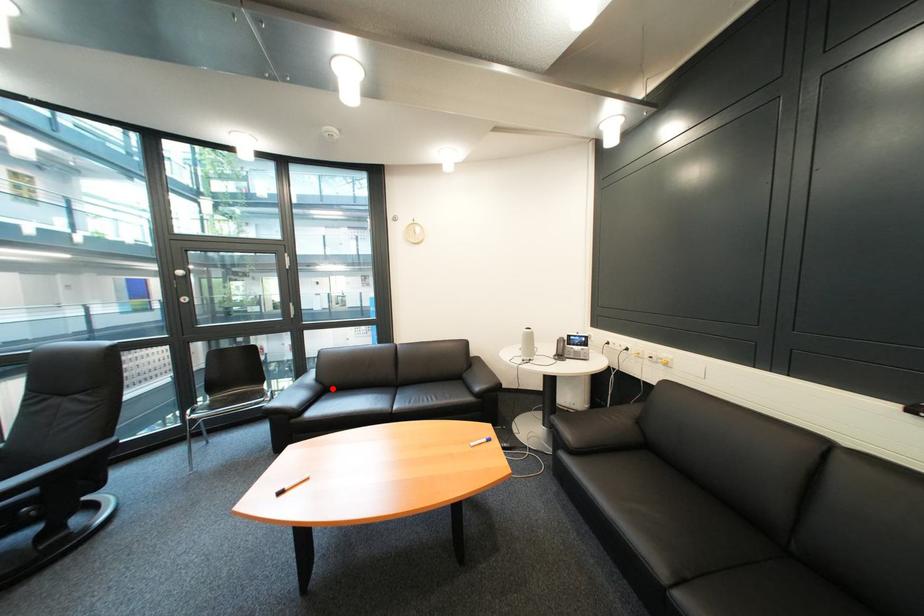
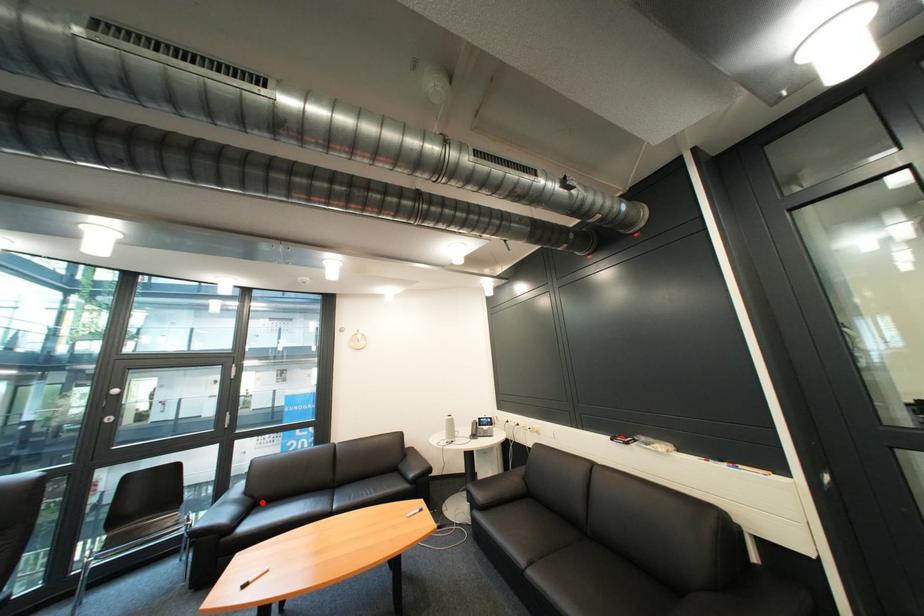
I am providing you with two images of the same scene from different viewpoints. A red point is marked on the first image and another point is marked on the second image. Do the highlighted points in image1 and image2 indicate the same real-world spot?

Yes